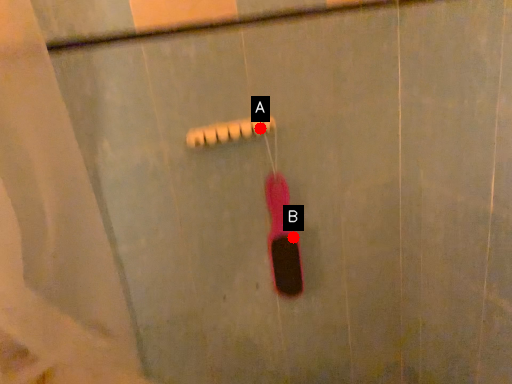
Question: Two points are circled on the image, labeled by A and B beside each circle. Which point appears farthest from the camera in this image?

Choices:
 (A) A is further
 (B) B is further

Answer: (B)